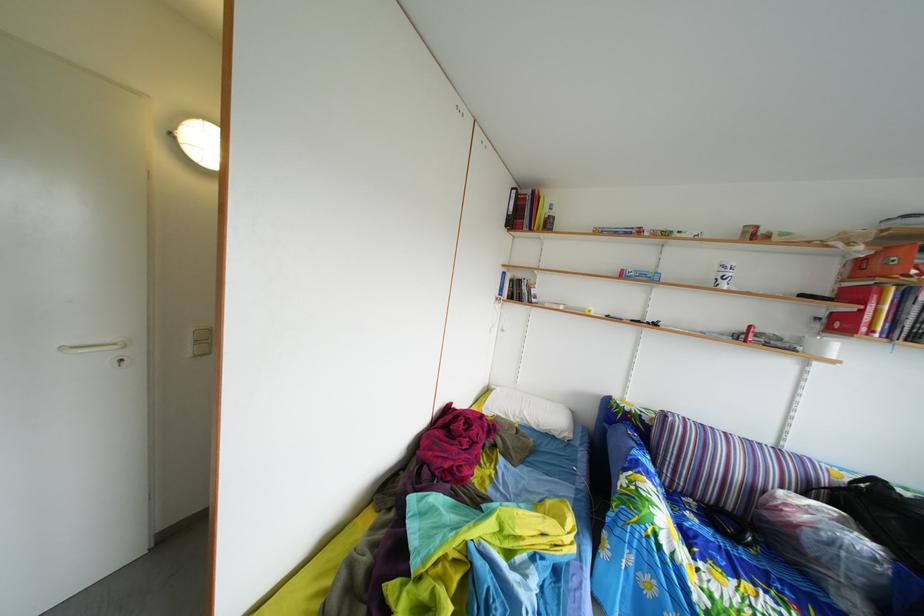
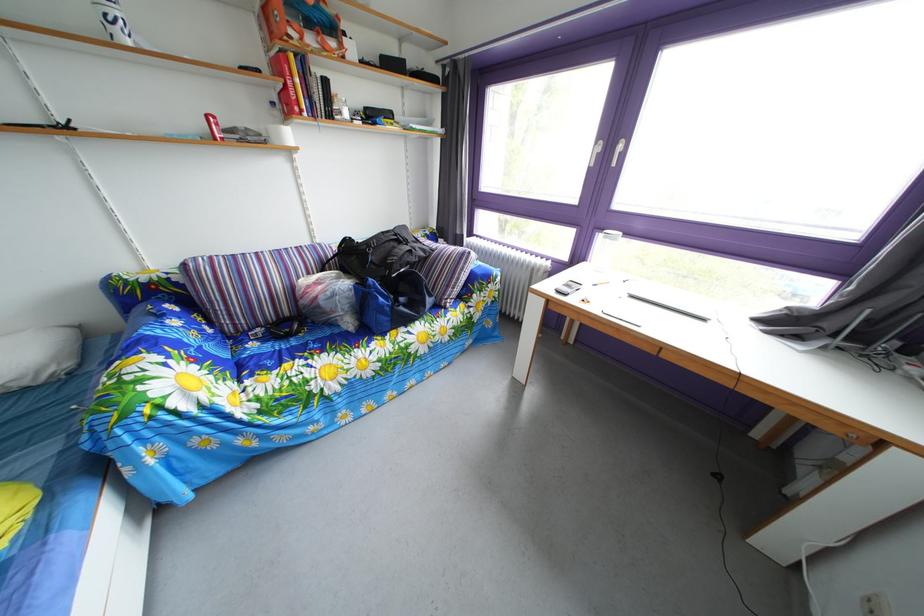
The point at (699,524) is marked in the first image. Where is the corresponding point in the second image?

(262, 353)